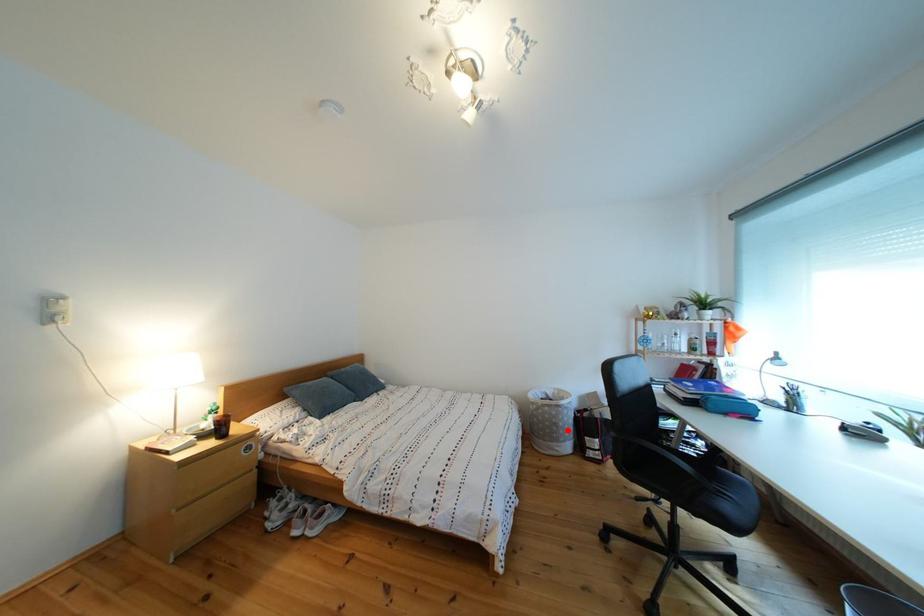
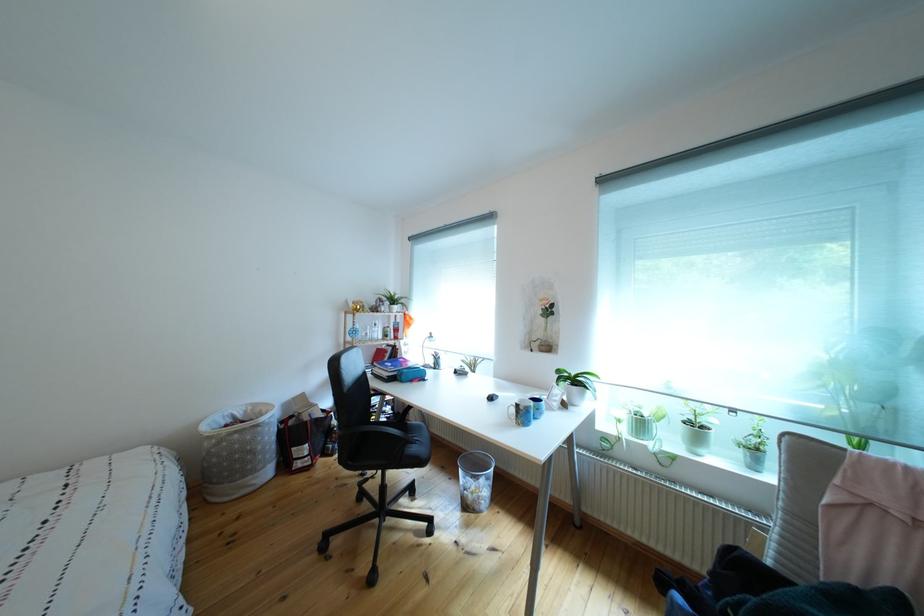
Question: I am providing you with two images of the same scene from different viewpoints. A red point is shown in image1. For the corresponding object point in image2, is it positioned nearer or farther from the camera?

Choices:
 (A) Nearer
 (B) Farther

Answer: (A)